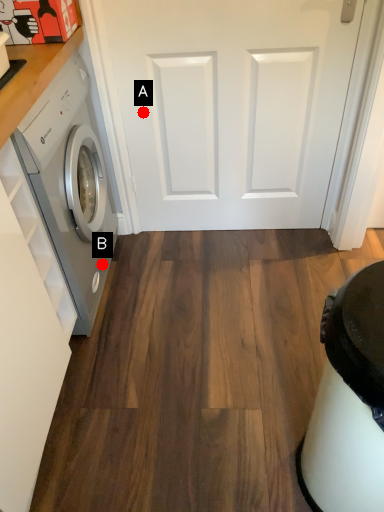
Question: Two points are circled on the image, labeled by A and B beside each circle. Which point is farther to the camera?

Choices:
 (A) A is further
 (B) B is further

Answer: (B)